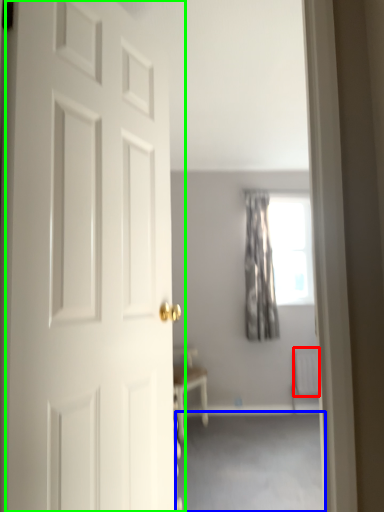
Question: Considering the real-world distances, which object is closest to radiator (highlighted by a red box)? corridor (highlighted by a blue box) or door (highlighted by a green box).

Choices:
 (A) corridor
 (B) door

Answer: (A)